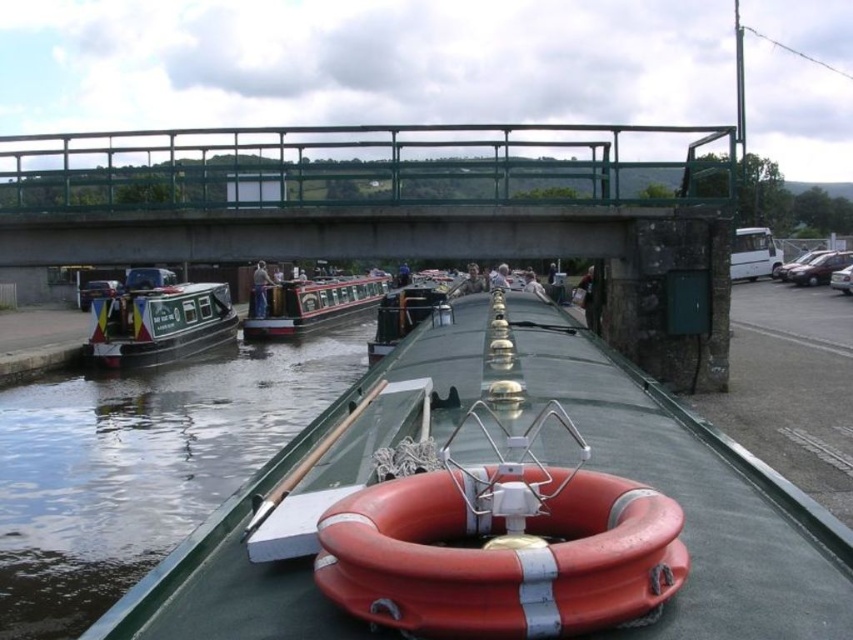
You are a boat operator planning to navigate under the green metal bridge at upper center while your boat is the polished wood canal boat at center. Considering their sizes, will the boat fit comfortably under the bridge?

The green metal bridge at upper center has a smaller size compared to the polished wood canal boat at center. Since the bridge is smaller, it may not provide enough clearance for the boat to pass underneath comfortably. The boat might be too large to fit under the bridge safely.

You are a passenger on the polished wood canal boat at center and want to grab the orange rubber lifebuoy at center. Can you reach it without leaving the boat?

The orange rubber lifebuoy at center is in front of the polished wood canal boat at center, so it is positioned ahead of the boat. Since you are on the boat, you can reach it by moving forward towards the bow where the lifebuoy is placed.

You are an inspector checking the safety of the canal boat. You notice the orange rubber lifebuoy at center and the green painted wood canal boat at left. Which object is smaller in size?

The orange rubber lifebuoy at center has a smaller size compared to the green painted wood canal boat at left.